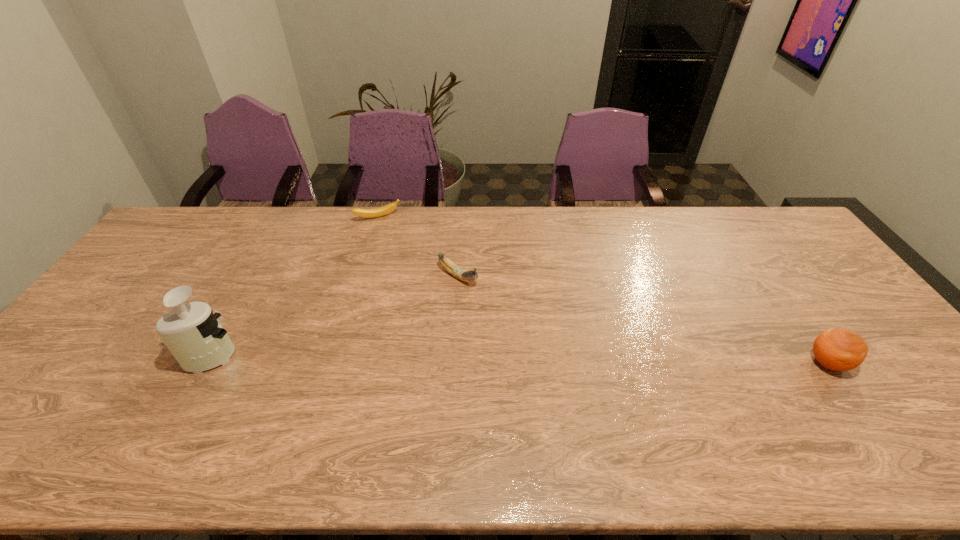
Where is `free space located on the peel of the third nearest object`? free space located on the peel of the third nearest object is located at coordinates coord(506,308).

Locate an element on the screen. The width and height of the screenshot is (960, 540). vacant area situated 0.110m on the peel of the third nearest object is located at coordinates coord(500,304).

You are a GUI agent. You are given a task and a screenshot of the screen. Output one action in this format:
    pyautogui.click(x=<x>, y=<y>)
    Task: Click on the vacant region located on the peel of the third nearest object
    
    Given the screenshot: What is the action you would take?
    pyautogui.click(x=537, y=327)

In order to click on free spot located 0.240m at the stem of the farther banana in this screenshot , I will do `click(408, 264)`.

Find the location of a particular element. This screenshot has height=540, width=960. free space located 0.310m at the stem of the farther banana is located at coordinates (416, 276).

Find the location of a particular element. The height and width of the screenshot is (540, 960). free space located 0.260m at the stem of the farther banana is located at coordinates (410, 267).

Locate an element on the screen. object positioned at the far edge is located at coordinates (377, 212).

Where is `object situated at the right edge`? The height and width of the screenshot is (540, 960). object situated at the right edge is located at coordinates (837, 349).

This screenshot has width=960, height=540. In order to click on vacant space at the far edge of the desktop in this screenshot , I will do `click(587, 208)`.

You are a GUI agent. You are given a task and a screenshot of the screen. Output one action in this format:
    pyautogui.click(x=<x>, y=<y>)
    Task: Click on the vacant point at the near edge
    
    Given the screenshot: What is the action you would take?
    pyautogui.click(x=214, y=408)